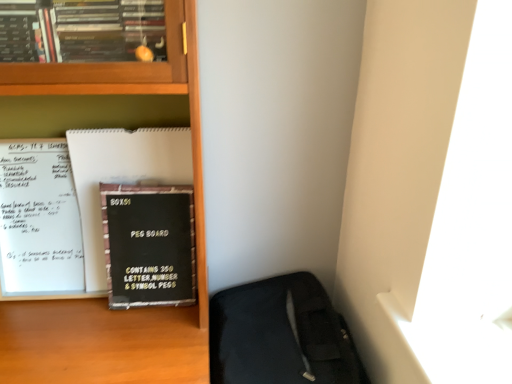
Question: Can you confirm if black matte peg board at center-left is shorter than black fabric sleeping bag at lower right?

Choices:
 (A) no
 (B) yes

Answer: (B)

Question: Is black matte peg board at center-left oriented away from black fabric sleeping bag at lower right?

Choices:
 (A) no
 (B) yes

Answer: (A)

Question: Is black matte peg board at center-left smaller than black fabric sleeping bag at lower right?

Choices:
 (A) no
 (B) yes

Answer: (B)

Question: From the image's perspective, is black matte peg board at center-left located beneath black fabric sleeping bag at lower right?

Choices:
 (A) no
 (B) yes

Answer: (A)

Question: Can you see black matte peg board at center-left touching black fabric sleeping bag at lower right?

Choices:
 (A) no
 (B) yes

Answer: (A)

Question: Is black fabric sleeping bag at lower right inside black matte peg board at center-left?

Choices:
 (A) yes
 (B) no

Answer: (B)

Question: Considering the relative sizes of black matte peg board at left and wooden bookcase at center in the image provided, is black matte peg board at left wider than wooden bookcase at center?

Choices:
 (A) no
 (B) yes

Answer: (A)

Question: Is black matte peg board at left to the left of wooden bookcase at center from the viewer's perspective?

Choices:
 (A) no
 (B) yes

Answer: (A)

Question: From the image's perspective, is black matte peg board at left located above wooden bookcase at center?

Choices:
 (A) yes
 (B) no

Answer: (A)

Question: Is black matte peg board at left shorter than wooden bookcase at center?

Choices:
 (A) yes
 (B) no

Answer: (A)

Question: Would you say wooden bookcase at center is part of black matte peg board at left's contents?

Choices:
 (A) yes
 (B) no

Answer: (B)

Question: Is the depth of black matte peg board at left greater than that of wooden bookcase at center?

Choices:
 (A) no
 (B) yes

Answer: (B)

Question: Does black matte peg board at left have a lesser width compared to black matte peg board at center-left?

Choices:
 (A) no
 (B) yes

Answer: (A)